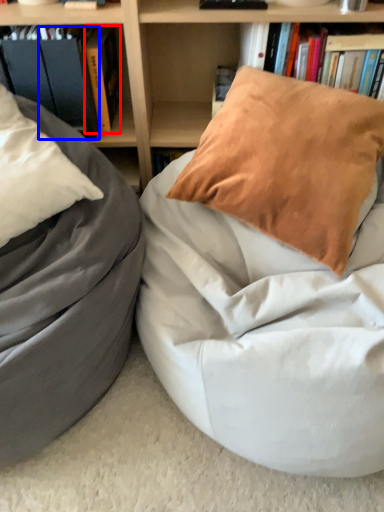
Question: Which of the following is the farthest to the observer, book (highlighted by a red box) or paperback book (highlighted by a blue box)?

Choices:
 (A) book
 (B) paperback book

Answer: (A)